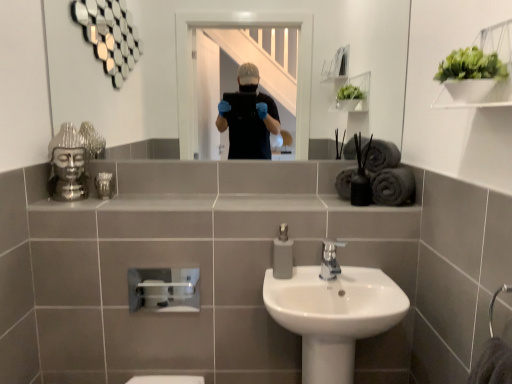
Question: From a real-world perspective, is metallic glass at upper left positioned under white glossy sink at center based on gravity?

Choices:
 (A) yes
 (B) no

Answer: (B)

Question: Considering the relative sizes of metallic glass at upper left and white glossy sink at center in the image provided, is metallic glass at upper left taller than white glossy sink at center?

Choices:
 (A) yes
 (B) no

Answer: (B)

Question: Is metallic glass at upper left closer to camera compared to white glossy sink at center?

Choices:
 (A) no
 (B) yes

Answer: (A)

Question: Does metallic glass at upper left have a lesser width compared to white glossy sink at center?

Choices:
 (A) yes
 (B) no

Answer: (A)

Question: Can you confirm if metallic glass at upper left is bigger than white glossy sink at center?

Choices:
 (A) yes
 (B) no

Answer: (B)

Question: Is dark gray matte bath towel at right, the second bath towel when ordered from top to bottom, taller or shorter than satin nickel faucet at center?

Choices:
 (A) short
 (B) tall

Answer: (B)

Question: Is dark gray matte bath towel at right, which is counted as the 1th bath towel, starting from the bottom, situated inside satin nickel faucet at center or outside?

Choices:
 (A) inside
 (B) outside

Answer: (B)

Question: Considering the positions of dark gray matte bath towel at right, which is counted as the 1th bath towel, starting from the bottom, and satin nickel faucet at center in the image, is dark gray matte bath towel at right, which is counted as the 1th bath towel, starting from the bottom, wider or thinner than satin nickel faucet at center?

Choices:
 (A) thin
 (B) wide

Answer: (A)

Question: From the image's perspective, is dark gray matte bath towel at right, the second bath towel when ordered from top to bottom, positioned above or below satin nickel faucet at center?

Choices:
 (A) below
 (B) above

Answer: (B)

Question: Considering the positions of gray matte towel at upper right, the 1th bath towel positioned from the top, and dark gray matte bath towel at right, which is counted as the 1th bath towel, starting from the bottom, in the image, is gray matte towel at upper right, the 1th bath towel positioned from the top, taller or shorter than dark gray matte bath towel at right, which is counted as the 1th bath towel, starting from the bottom,?

Choices:
 (A) short
 (B) tall

Answer: (A)

Question: Considering the positions of gray matte towel at upper right, which is the second bath towel in bottom-to-top order, and dark gray matte bath towel at right, which is counted as the 1th bath towel, starting from the bottom, in the image, is gray matte towel at upper right, which is the second bath towel in bottom-to-top order, wider or thinner than dark gray matte bath towel at right, which is counted as the 1th bath towel, starting from the bottom,?

Choices:
 (A) thin
 (B) wide

Answer: (B)

Question: Looking at the image, does gray matte towel at upper right, the 1th bath towel positioned from the top, seem bigger or smaller compared to dark gray matte bath towel at right, which is counted as the 1th bath towel, starting from the bottom?

Choices:
 (A) big
 (B) small

Answer: (B)

Question: From a real-world perspective, is gray matte towel at upper right, the 1th bath towel positioned from the top, positioned above or below dark gray matte bath towel at right, which is counted as the 1th bath towel, starting from the bottom?

Choices:
 (A) above
 (B) below

Answer: (A)

Question: In terms of size, does white glossy sink at center appear bigger or smaller than matte gray soap dispenser at center?

Choices:
 (A) small
 (B) big

Answer: (B)

Question: From the image's perspective, is white glossy sink at center positioned above or below matte gray soap dispenser at center?

Choices:
 (A) above
 (B) below

Answer: (B)